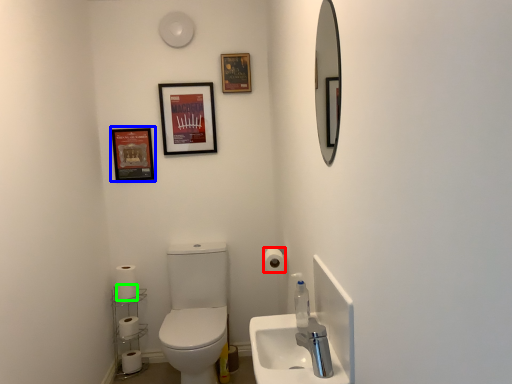
Question: Which object is the farthest from toilet paper (highlighted by a red box)? Choose among these: decorative picture (highlighted by a blue box) or toilet paper (highlighted by a green box).

Choices:
 (A) decorative picture
 (B) toilet paper

Answer: (A)